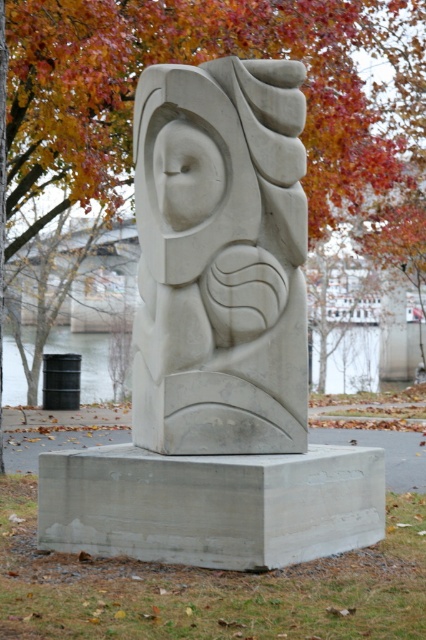
Does point (261, 333) come behind point (25, 241)?

No, (261, 333) is in front of (25, 241).

Between point (227, 152) and point (259, 16), which one is positioned in front?

Point (227, 152) is more forward.

Locate an element on the screen. This screenshot has height=640, width=426. white stone owl at center is located at coordinates coord(221,259).